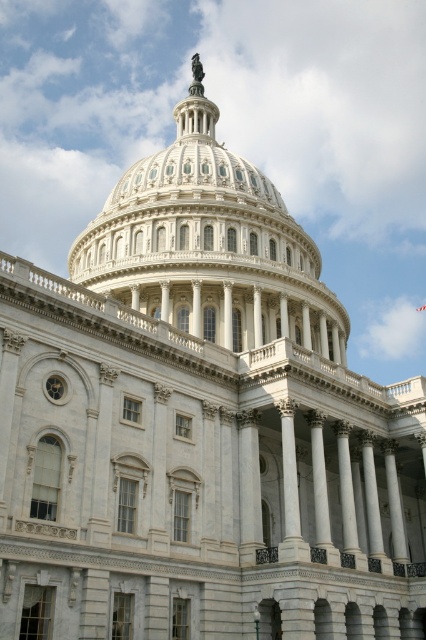
Question: Does white marble dome at center appear on the left side of white fabric flag at upper center?

Choices:
 (A) no
 (B) yes

Answer: (B)

Question: Which of the following is the farthest from the observer?

Choices:
 (A) white marble dome at center
 (B) white marble column at center

Answer: (A)

Question: In this image, where is white marble dome at center located relative to white marble column at center?

Choices:
 (A) below
 (B) above

Answer: (B)

Question: Which point is closer to the camera?

Choices:
 (A) (207, 314)
 (B) (397, 477)
 (C) (417, 308)

Answer: (B)

Question: Does white marble column at center have a smaller size compared to white fabric flag at upper center?

Choices:
 (A) no
 (B) yes

Answer: (A)

Question: Which point is farther from the camera taking this photo?

Choices:
 (A) (187, 100)
 (B) (396, 561)

Answer: (A)